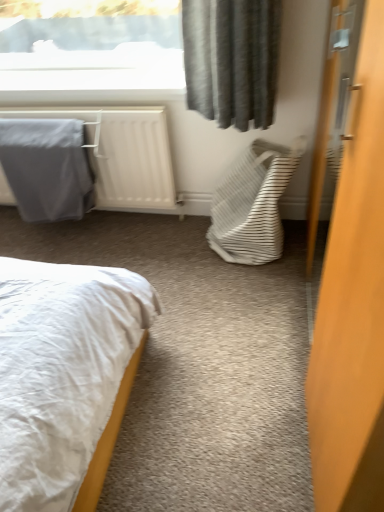
Question: Looking at the image, does wooden door at right seem bigger or smaller compared to gray fabric at left?

Choices:
 (A) small
 (B) big

Answer: (B)

Question: Is wooden door at right taller or shorter than gray fabric at left?

Choices:
 (A) short
 (B) tall

Answer: (B)

Question: Which of these objects is positioned closest to the white striped fabric laundry basket at center-right?

Choices:
 (A) gray fabric at left
 (B) wooden door at right
 (C) gray fabric blanket at left

Answer: (A)

Question: Which object is positioned farthest from the white striped fabric laundry basket at center-right?

Choices:
 (A) gray fabric at left
 (B) wooden door at right
 (C) gray fabric blanket at left

Answer: (B)